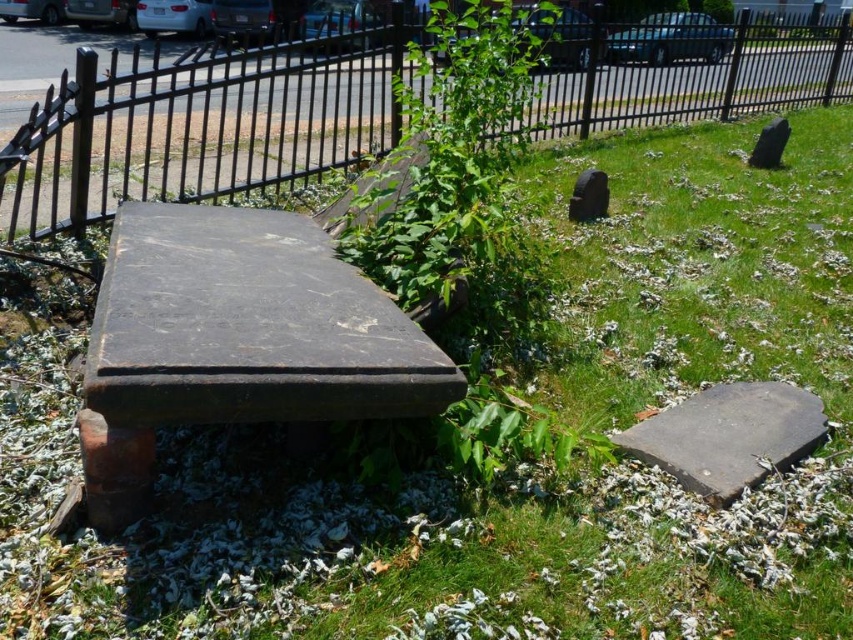
You are standing at the point marked by the coordinates point (457, 173) in the image. What object is directly in front of you?

The point (457, 173) corresponds to the green leafy plant at center, so the object directly in front of you is the green leafy plant at center.